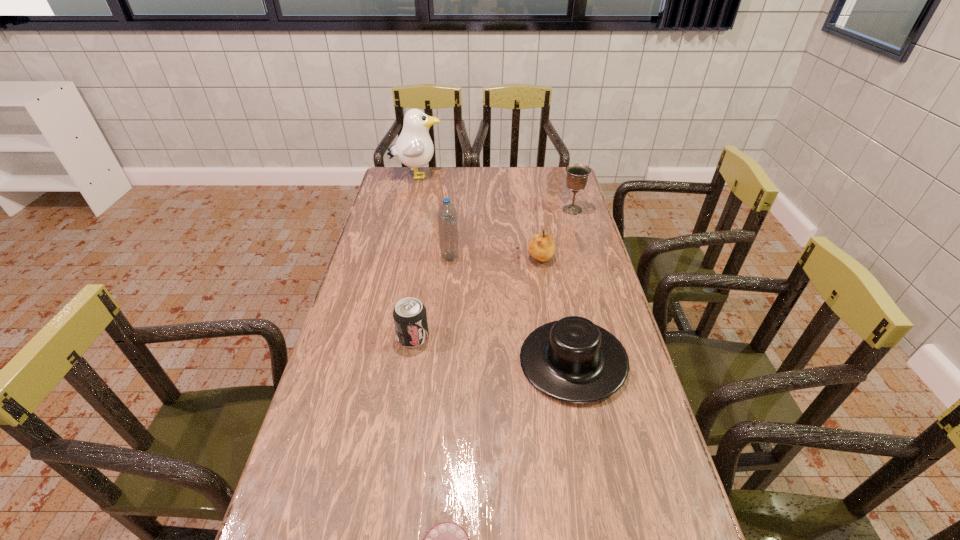
This screenshot has width=960, height=540. I want to click on vacant space at the far edge, so click(x=501, y=172).

In the image, there is a desktop. What are the coordinates of `free space at the left edge` in the screenshot? It's located at (321, 496).

Find the location of a particular element. The image size is (960, 540). free region at the right edge of the desktop is located at coordinates (592, 235).

In order to click on vacant area between the water bottle and the dress hat in this screenshot , I will do `click(512, 308)`.

Locate an element on the screen. This screenshot has height=540, width=960. vacant region between the tallest object and the water bottle is located at coordinates (433, 217).

Locate an element on the screen. free space between the pear and the soda can is located at coordinates (474, 298).

Locate an element on the screen. This screenshot has height=540, width=960. vacant space in between the soda can and the gull is located at coordinates (415, 256).

Locate which object is the third closest to the chalice. Please provide its 2D coordinates. Your answer should be formatted as a tuple, i.e. [(x, y)], where the tuple contains the x and y coordinates of a point satisfying the conditions above.

[(414, 148)]

Identify the location of object that stands as the sixth closest to the tallest object. The height and width of the screenshot is (540, 960). (447, 539).

At what (x,y) coordinates should I click in order to perform the action: click on free space that satisfies the following two spatial constraints: 1. on the beak of the tallest object; 2. on the back side of the soda can. Please return your answer as a coordinate pair (x, y). This screenshot has height=540, width=960. Looking at the image, I should click on (381, 337).